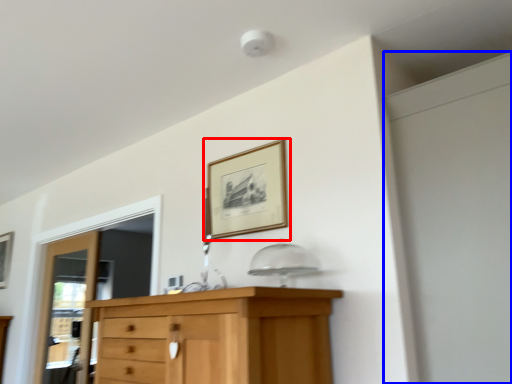
Question: Which object appears closest to the camera in this image, picture frame (highlighted by a red box) or screen door (highlighted by a blue box)?

Choices:
 (A) picture frame
 (B) screen door

Answer: (B)